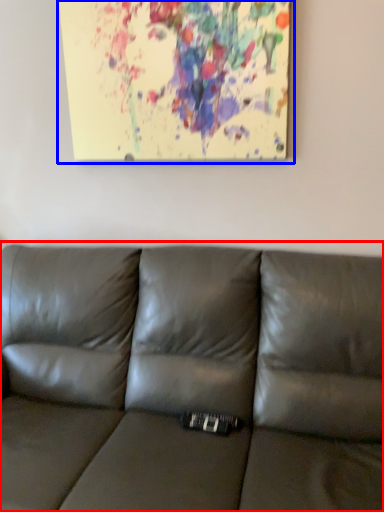
Question: Which point is closer to the camera, studio couch (highlighted by a red box) or oil painting (highlighted by a blue box)?

Choices:
 (A) studio couch
 (B) oil painting

Answer: (A)